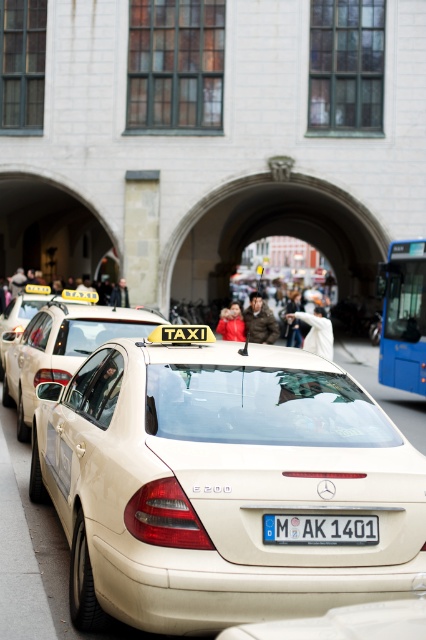
Between point (115, 323) and point (400, 260), which one is positioned in front?

Point (115, 323) is in front.

Is point (154, 317) positioned in front of point (397, 298)?

Yes, point (154, 317) is in front of point (397, 298).

Identify the location of metallic beige taxi at center. (62, 349).

Is point (409, 572) closer to viewer compared to point (23, 326)?

Yes, it is.

Is matte beige taxi at center closer to the viewer compared to beige matte taxi at center?

That is True.

Does point (192, 538) lie behind point (40, 294)?

No, (192, 538) is in front of (40, 294).

This screenshot has width=426, height=640. Identify the location of matte beige taxi at center. (219, 483).

Is metallic beige taxi at center above beige matte taxi at center?

Actually, metallic beige taxi at center is below beige matte taxi at center.

Is metallic beige taxi at center closer to camera compared to beige matte taxi at center?

That is True.

The width and height of the screenshot is (426, 640). Describe the element at coordinates (62, 349) in the screenshot. I see `metallic beige taxi at center` at that location.

I want to click on metallic beige taxi at center, so click(x=62, y=349).